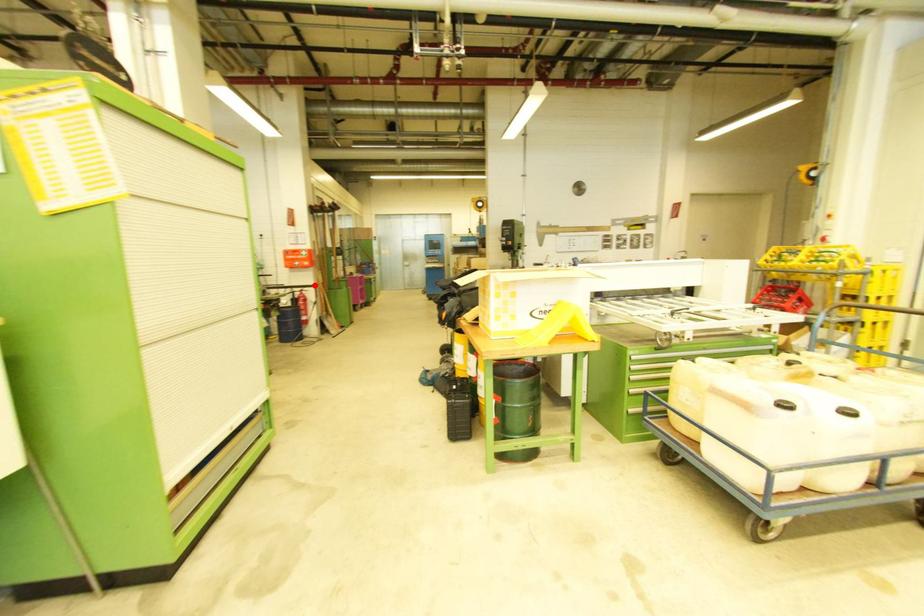
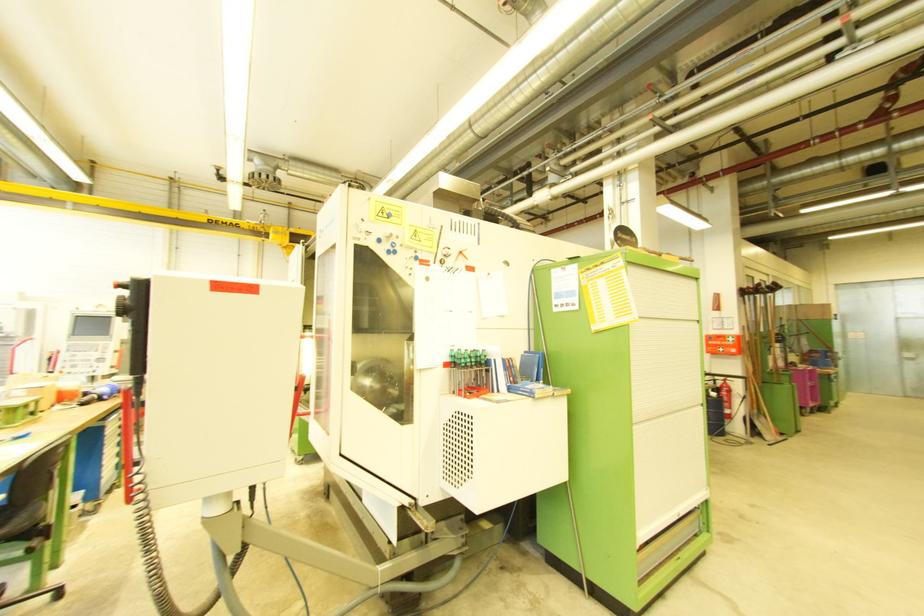
The point at the highlighted location is marked in the first image. Where is the corresponding point in the second image?

(740, 376)